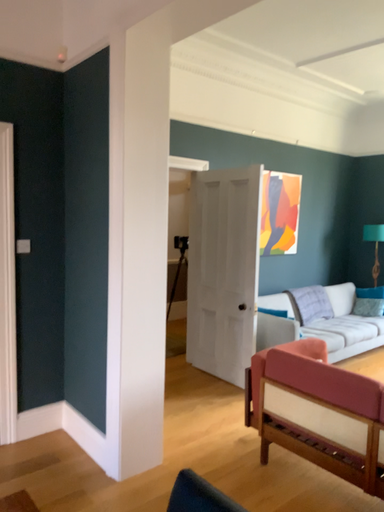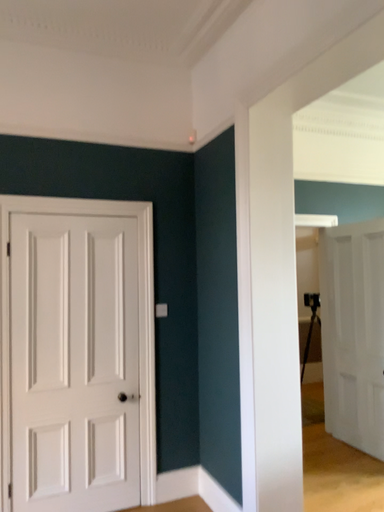
Question: Which way did the camera rotate in the video?

Choices:
 (A) rotated left
 (B) rotated right

Answer: (A)